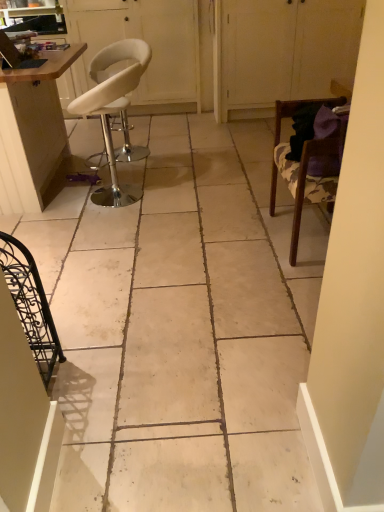
Question: Is wooden chair at right, which is the second chair from front to back, outside of white matte cabinet at upper right, which is the 2th screen door in left-to-right order?

Choices:
 (A) yes
 (B) no

Answer: (A)

Question: Is the depth of wooden chair at right, placed as the second chair when sorted from back to front, greater than that of white matte cabinet at upper right, which is the 2th screen door in left-to-right order?

Choices:
 (A) no
 (B) yes

Answer: (A)

Question: Considering the relative sizes of wooden chair at right, which is the second chair from front to back, and white matte cabinet at upper right, which is the 2th screen door in left-to-right order, in the image provided, is wooden chair at right, which is the second chair from front to back, taller than white matte cabinet at upper right, which is the 2th screen door in left-to-right order,?

Choices:
 (A) yes
 (B) no

Answer: (B)

Question: Is wooden chair at right, placed as the second chair when sorted from back to front, to the left of white matte cabinet at upper right, arranged as the 1th screen door when viewed from the right, from the viewer's perspective?

Choices:
 (A) yes
 (B) no

Answer: (A)

Question: From the image's perspective, would you say wooden chair at right, which is the second chair from front to back, is positioned over white matte cabinet at upper right, arranged as the 1th screen door when viewed from the right?

Choices:
 (A) no
 (B) yes

Answer: (A)

Question: Considering the positions of wooden chair at right, the first chair positioned from the right, and white leather stool at upper left, the second screen door viewed from the right, in the image, is wooden chair at right, the first chair positioned from the right, taller or shorter than white leather stool at upper left, the second screen door viewed from the right,?

Choices:
 (A) short
 (B) tall

Answer: (A)

Question: From the image's perspective, is wooden chair at right, which is the second chair from front to back, above or below white leather stool at upper left, which ranks as the first screen door in left-to-right order?

Choices:
 (A) above
 (B) below

Answer: (B)

Question: In the image, is wooden chair at right, the first chair positioned from the right, positioned in front of or behind white leather stool at upper left, the second screen door viewed from the right?

Choices:
 (A) front
 (B) behind

Answer: (A)

Question: Does point (299, 192) appear closer or farther from the camera than point (104, 44)?

Choices:
 (A) closer
 (B) farther

Answer: (A)

Question: Considering the positions of white leather stool at left, which appears as the 2th chair when viewed from the left, and wooden table at left in the image, is white leather stool at left, which appears as the 2th chair when viewed from the left, taller or shorter than wooden table at left?

Choices:
 (A) tall
 (B) short

Answer: (B)

Question: Is white leather stool at left, which appears as the 2th chair when viewed from the left, wider or thinner than wooden table at left?

Choices:
 (A) thin
 (B) wide

Answer: (A)

Question: From the image's perspective, is white leather stool at left, which ranks as the third chair in front-to-back order, above or below wooden table at left?

Choices:
 (A) below
 (B) above

Answer: (A)

Question: From a real-world perspective, relative to wooden table at left, is white leather stool at left, which ranks as the third chair in front-to-back order, vertically above or below?

Choices:
 (A) above
 (B) below

Answer: (B)

Question: Is white leather stool at left, which appears as the 2th chair when viewed from the left, in front of or behind black wrought iron chair at lower left, the 3th chair from the right, in the image?

Choices:
 (A) behind
 (B) front

Answer: (A)

Question: Considering the relative positions of white leather stool at left, which appears as the 2th chair when viewed from the left, and black wrought iron chair at lower left, the 3th chair from the right, in the image provided, is white leather stool at left, which appears as the 2th chair when viewed from the left, to the left or to the right of black wrought iron chair at lower left, the 3th chair from the right,?

Choices:
 (A) right
 (B) left

Answer: (A)